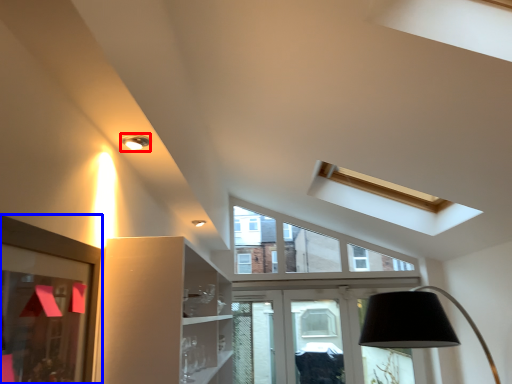
Question: Which of the following is the closest to the observer, light fixture (highlighted by a red box) or picture frame (highlighted by a blue box)?

Choices:
 (A) light fixture
 (B) picture frame

Answer: (B)